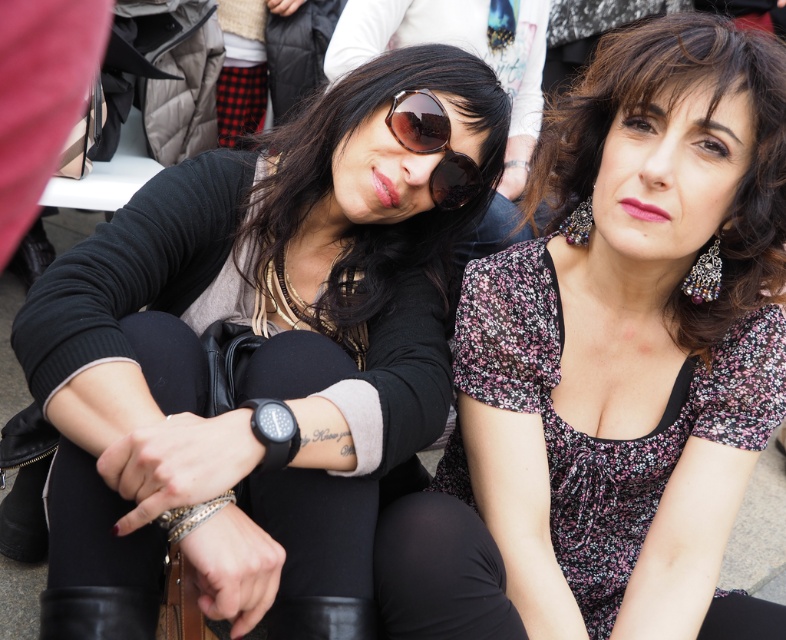
Looking at this image, you are a photographer trying to capture a closeup of the sunglasses at center and the black leather boot at lower center. Since you want both items to appear similarly sized in the photo, which object should you move closer to the camera?

Since the sunglasses at center is larger in size than the black leather boot at lower center, you should move the black leather boot at lower center closer to the camera to make them appear similar in size in the photo.

You are a photographer trying to focus on the point at coordinates (632, 340) in the image. According to the scene description, where is this point located?

The point at coordinates (632, 340) is located on the floral patterned fabric top at center.